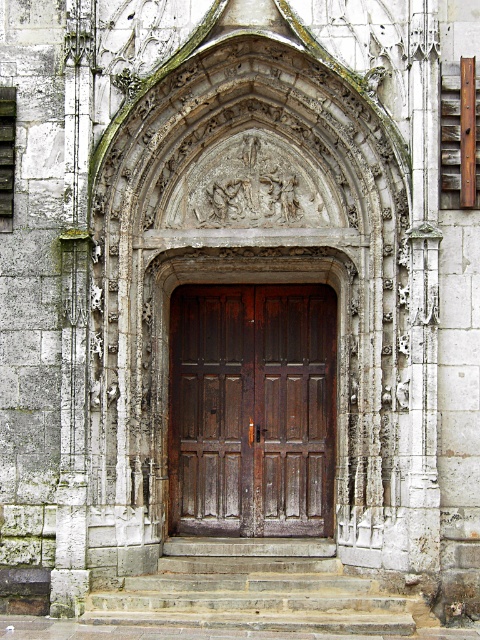
Is dark brown wood door at center positioned at the back of stone steps at center?

Yes, dark brown wood door at center is behind stone steps at center.

Does dark brown wood door at center appear on the left side of stone steps at center?

Indeed, dark brown wood door at center is positioned on the left side of stone steps at center.

The width and height of the screenshot is (480, 640). I want to click on dark brown wood door at center, so click(x=252, y=410).

Where is `dark brown wood door at center`? dark brown wood door at center is located at coordinates (252, 410).